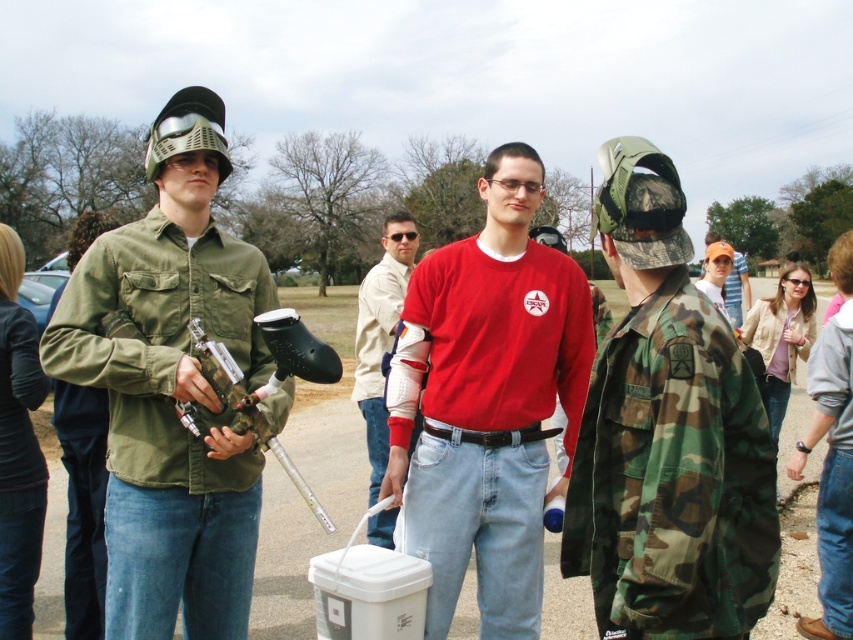
Does point (369, 352) come in front of point (746, 307)?

Yes.

The width and height of the screenshot is (853, 640). Find the location of `white textured arm guard at center`. white textured arm guard at center is located at coordinates (380, 333).

Find the location of a particular element. This screenshot has height=640, width=853. white textured arm guard at center is located at coordinates (380, 333).

Does point (178, 440) come closer to viewer compared to point (529, 205)?

Yes, point (178, 440) is closer to viewer.

Who is more distant from viewer, [167,509] or [561,381]?

Point [561,381]

Find the location of a particular element. The height and width of the screenshot is (640, 853). matte green shirt at center is located at coordinates (171, 388).

Between camo fabric jacket at center and red matte shirt at center, which one appears on the right side from the viewer's perspective?

camo fabric jacket at center is more to the right.

Can you confirm if camo fabric jacket at center is positioned below red matte shirt at center?

Yes.

Locate an element on the screen. Image resolution: width=853 pixels, height=640 pixels. camo fabric jacket at center is located at coordinates (666, 435).